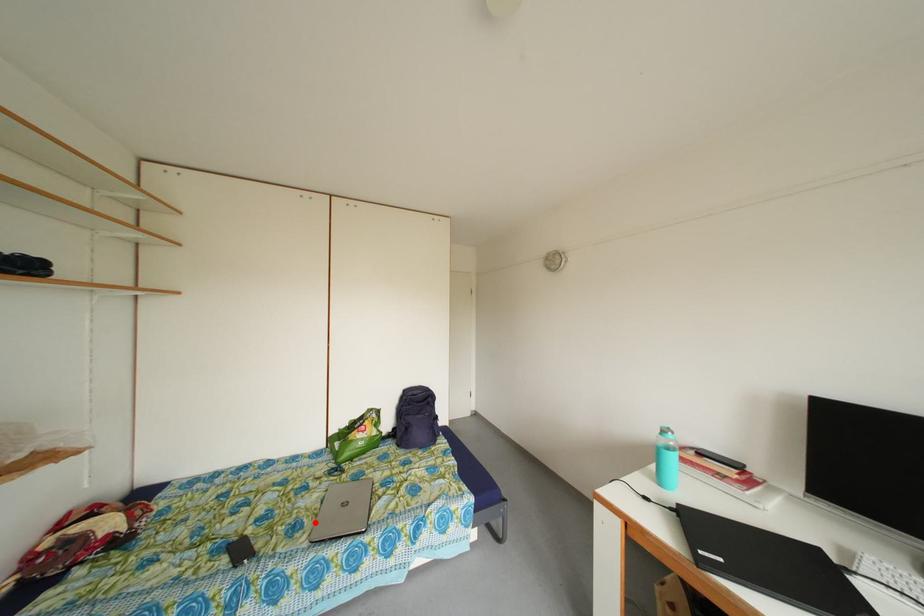
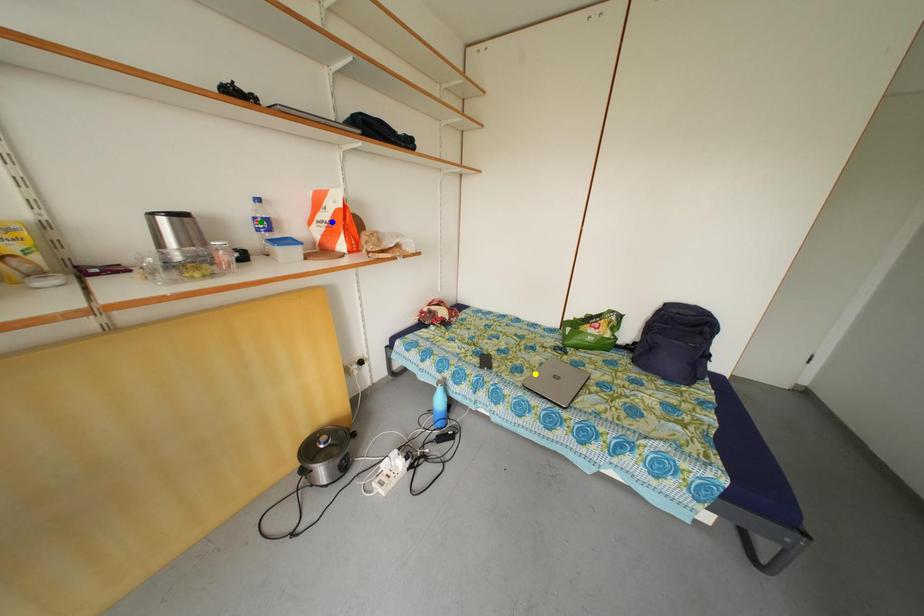
Question: I am providing you with two images of the same scene from different viewpoints. A red point is marked on the first image. You are given multiple points on the second image. In image 2, which mark is for the same physical point as the one in image 1?

Choices:
 (A) yellow point
 (B) blue point
 (C) green point

Answer: (A)